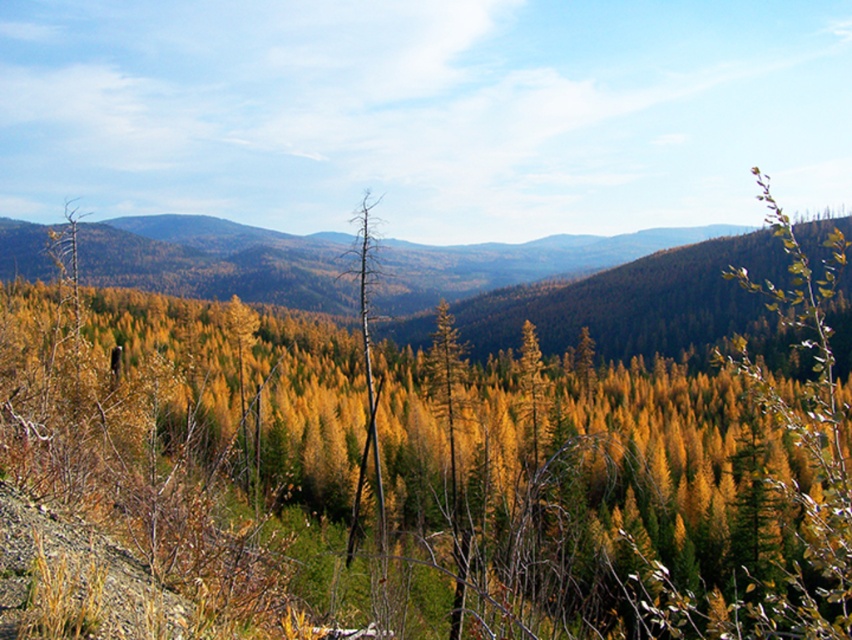
Question: Does green forested mountain at upper center appear on the left side of dead wood tree at center?

Choices:
 (A) no
 (B) yes

Answer: (B)

Question: Which object is the farthest from the green forested mountain at upper center?

Choices:
 (A) dead wood tree at center
 (B) yellow-green foliage at center

Answer: (A)

Question: Which object is positioned farthest from the dead wood tree at center?

Choices:
 (A) yellow-green foliage at center
 (B) green forested mountain at upper center

Answer: (B)

Question: Can you confirm if yellow-green foliage at center is thinner than green forested mountain at upper center?

Choices:
 (A) yes
 (B) no

Answer: (A)

Question: Which point is farther to the camera?

Choices:
 (A) yellow-green foliage at center
 (B) green forested mountain at upper center
 (C) dead wood tree at center

Answer: (B)

Question: Does yellow-green foliage at center appear on the right side of green forested mountain at upper center?

Choices:
 (A) yes
 (B) no

Answer: (A)